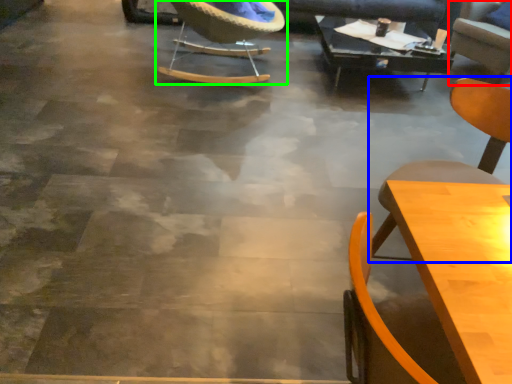
Question: Based on their relative distances, which object is farther from chair (highlighted by a red box)? Choose from chair (highlighted by a blue box) and chair (highlighted by a green box).

Choices:
 (A) chair
 (B) chair

Answer: (A)